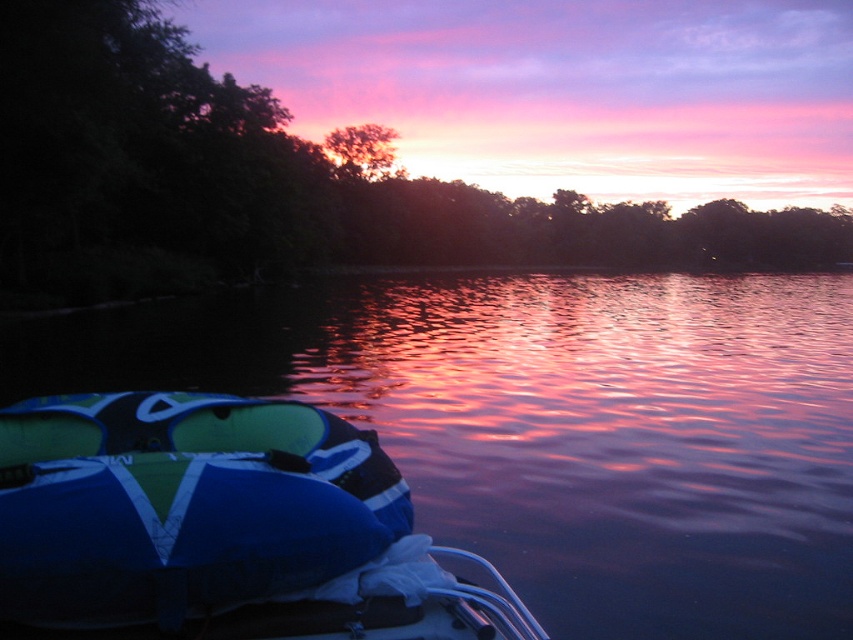
Question: Is glossy water at center positioned before green leafy tree at center?

Choices:
 (A) yes
 (B) no

Answer: (A)

Question: Among these objects, which one is farthest from the camera?

Choices:
 (A) silhouetted tree at center
 (B) blue fabric boat at lower left
 (C) green leafy tree at center

Answer: (A)

Question: From the image, what is the correct spatial relationship of green leafy tree at center in relation to silhouetted tree at center?

Choices:
 (A) left
 (B) right

Answer: (B)

Question: Considering the relative positions of glossy water at center and blue fabric boat at lower left in the image provided, where is glossy water at center located with respect to blue fabric boat at lower left?

Choices:
 (A) left
 (B) right

Answer: (B)

Question: Which of the following is the farthest from the observer?

Choices:
 (A) glossy water at center
 (B) green leafy tree at center
 (C) blue fabric boat at lower left
 (D) silhouetted tree at center

Answer: (D)

Question: Among these points, which one is farthest from the camera?

Choices:
 (A) (401, 496)
 (B) (97, 179)
 (C) (361, 330)
 (D) (337, 168)

Answer: (D)